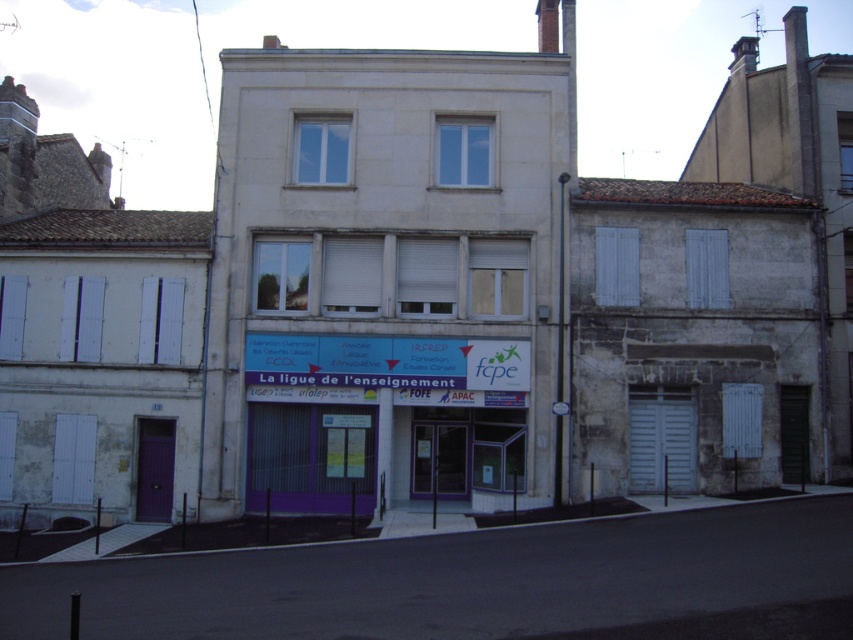
Between white stone building at center and purple matte signboard at center, which one has less height?

purple matte signboard at center is shorter.

Which is more to the right, white stone building at center or purple matte signboard at center?

Positioned to the right is purple matte signboard at center.

Does point (422, 484) come behind point (370, 344)?

Yes, it is behind point (370, 344).

Where is `white stone building at center`? The width and height of the screenshot is (853, 640). white stone building at center is located at coordinates (387, 276).